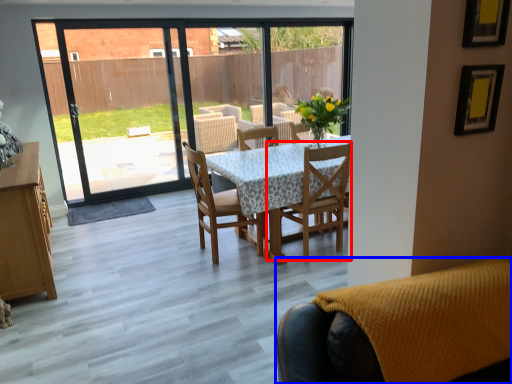
Question: Which of the following is the farthest to the observer, chair (highlighted by a red box) or chair (highlighted by a blue box)?

Choices:
 (A) chair
 (B) chair

Answer: (A)